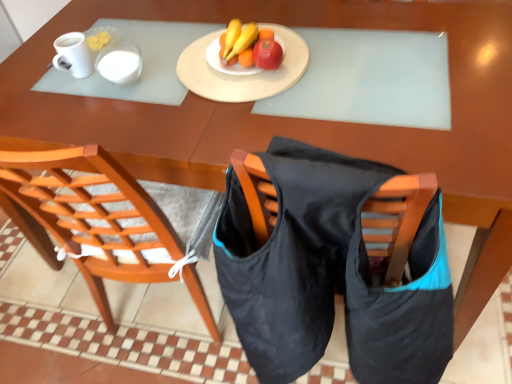
At what (x,y) coordinates should I click in order to perform the action: click on space that is in front of matte red apple at center. Please return your answer as a coordinate pair (x, y). Image resolution: width=512 pixels, height=384 pixels. Looking at the image, I should click on (249, 100).